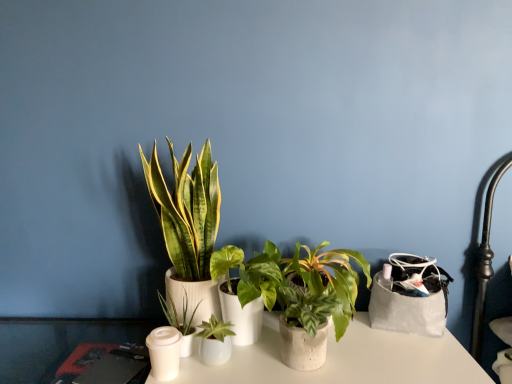
Image resolution: width=512 pixels, height=384 pixels. Describe the element at coordinates (316, 302) in the screenshot. I see `speckled concrete pot at center, the 5th houseplant from the left` at that location.

At what (x,y) coordinates should I click in order to perform the action: click on green leafy plant at center, the first houseplant viewed from the left. Please return your answer as a coordinate pair (x, y). The image size is (512, 384). Looking at the image, I should click on (188, 227).

Where is `green matte plant at center, marked as the 3th houseplant in a right-to-left arrangement`? This screenshot has height=384, width=512. green matte plant at center, marked as the 3th houseplant in a right-to-left arrangement is located at coordinates (215, 341).

Is green leafy plant at center, the fifth houseplant viewed from the right, further to camera compared to green matte plant at center, acting as the second houseplant starting from the right?

Yes, it is behind green matte plant at center, acting as the second houseplant starting from the right.

Which point is more distant from viewer, (204, 251) or (212, 266)?

The point (204, 251) is farther from the camera.

Is green leafy plant at center, the first houseplant viewed from the left, not inside green matte plant at center, the 4th houseplant from the left?

Indeed, green leafy plant at center, the first houseplant viewed from the left, is completely outside green matte plant at center, the 4th houseplant from the left.

Can we say white matte candle holder at lower left lies outside green matte plant at center, acting as the second houseplant starting from the right?

Absolutely, white matte candle holder at lower left is external to green matte plant at center, acting as the second houseplant starting from the right.

From a real-world perspective, is white matte candle holder at lower left physically below green matte plant at center, acting as the second houseplant starting from the right?

Yes, from a real-world perspective, white matte candle holder at lower left is beneath green matte plant at center, acting as the second houseplant starting from the right.

Is white matte candle holder at lower left at the left side of green matte plant at center, the 4th houseplant from the left?

Correct, you'll find white matte candle holder at lower left to the left of green matte plant at center, the 4th houseplant from the left.

Does white matte candle holder at lower left have a greater width compared to green matte plant at center, acting as the second houseplant starting from the right?

In fact, white matte candle holder at lower left might be narrower than green matte plant at center, acting as the second houseplant starting from the right.

Considering the relative positions of green leafy plant at center, the fifth houseplant viewed from the right, and white matte candle holder at lower left in the image provided, is green leafy plant at center, the fifth houseplant viewed from the right, to the right of white matte candle holder at lower left from the viewer's perspective?

Indeed, green leafy plant at center, the fifth houseplant viewed from the right, is positioned on the right side of white matte candle holder at lower left.

Is green leafy plant at center, the first houseplant viewed from the left, facing away from white matte candle holder at lower left?

green leafy plant at center, the first houseplant viewed from the left, is not turned away from white matte candle holder at lower left.

Can you confirm if green leafy plant at center, the first houseplant viewed from the left, is smaller than white matte candle holder at lower left?

No, green leafy plant at center, the first houseplant viewed from the left, is not smaller than white matte candle holder at lower left.

Is there a large distance between green leafy plant at center, the first houseplant viewed from the left, and white matte candle holder at lower left?

They are positioned close to each other.

I want to click on houseplant that is the 1st one when counting upward from the white matte candle holder at lower left (from the image's perspective), so click(x=215, y=341).

Measure the distance from green matte plant at center, marked as the 3th houseplant in a right-to-left arrangement, to white matte candle holder at lower left.

green matte plant at center, marked as the 3th houseplant in a right-to-left arrangement, and white matte candle holder at lower left are 3.51 inches apart from each other.

Looking at their sizes, would you say green matte plant at center, which is counted as the 3th houseplant, starting from the left, is wider or thinner than white matte candle holder at lower left?

green matte plant at center, which is counted as the 3th houseplant, starting from the left, is wider than white matte candle holder at lower left.

Which object is positioned more to the right, green leafy plant at center, the fifth houseplant viewed from the right, or green matte plant at center, which is counted as the 3th houseplant, starting from the left?

green matte plant at center, which is counted as the 3th houseplant, starting from the left, is more to the right.

Does point (178, 305) come closer to viewer compared to point (201, 333)?

That is False.

From a real-world perspective, is green leafy plant at center, the fifth houseplant viewed from the right, positioned over green matte plant at center, which is counted as the 3th houseplant, starting from the left, based on gravity?

→ Yes, from a real-world perspective, green leafy plant at center, the fifth houseplant viewed from the right, is above green matte plant at center, which is counted as the 3th houseplant, starting from the left.

Between green matte plant at center, the 4th houseplant from the left, and speckled concrete pot at center, the 5th houseplant from the left, which one appears on the left side from the viewer's perspective?

From the viewer's perspective, green matte plant at center, the 4th houseplant from the left, appears more on the left side.

Could you tell me if green matte plant at center, acting as the second houseplant starting from the right, is turned towards speckled concrete pot at center, arranged as the 1th houseplant when viewed from the right?

No, green matte plant at center, acting as the second houseplant starting from the right, does not turn towards speckled concrete pot at center, arranged as the 1th houseplant when viewed from the right.

Is green matte plant at center, acting as the second houseplant starting from the right, behind speckled concrete pot at center, arranged as the 1th houseplant when viewed from the right?

No, it is in front of speckled concrete pot at center, arranged as the 1th houseplant when viewed from the right.

From a real-world perspective, between white matte candle holder at lower left and green matte plant at center, the 2th houseplant positioned from the left, who is vertically higher?

green matte plant at center, the 2th houseplant positioned from the left, from a real-world perspective.

Is green matte plant at center, the 2th houseplant positioned from the left, at the back of white matte candle holder at lower left?

Yes, white matte candle holder at lower left is positioned with its back facing green matte plant at center, the 2th houseplant positioned from the left.

What's the angular difference between white matte candle holder at lower left and green matte plant at center, the 2th houseplant positioned from the left,'s facing directions?

The facing directions of white matte candle holder at lower left and green matte plant at center, the 2th houseplant positioned from the left, are 4.82 degrees apart.

From the image's perspective, which houseplant is the 2nd one above the green matte plant at center, acting as the second houseplant starting from the right? Please provide its 2D coordinates.

[(188, 227)]

At what (x,y) coordinates should I click in order to perform the action: click on candle holder that appears behind the green matte plant at center, acting as the second houseplant starting from the right. Please return your answer as a coordinate pair (x, y). Looking at the image, I should click on (164, 352).

When comparing their distances from green matte plant at center, which ranks as the 4th houseplant in right-to-left order, does green matte plant at center, acting as the second houseplant starting from the right, or speckled concrete pot at center, the 5th houseplant from the left, seem further?

speckled concrete pot at center, the 5th houseplant from the left, is positioned further to the anchor green matte plant at center, which ranks as the 4th houseplant in right-to-left order.

When comparing their distances from speckled concrete pot at center, arranged as the 1th houseplant when viewed from the right, does white matte candle holder at lower left or green leafy plant at center, the fifth houseplant viewed from the right, seem closer?

green leafy plant at center, the fifth houseplant viewed from the right, is positioned closer to the anchor speckled concrete pot at center, arranged as the 1th houseplant when viewed from the right.

Which object lies further to the anchor point speckled concrete pot at center, the 5th houseplant from the left, white matte candle holder at lower left or green matte plant at center, acting as the second houseplant starting from the right?

white matte candle holder at lower left.

Estimate the real-world distances between objects in this image. Which object is closer to green matte plant at center, which ranks as the 4th houseplant in right-to-left order, white matte candle holder at lower left or green leafy plant at center, the fifth houseplant viewed from the right?

white matte candle holder at lower left.

From the image, which object appears to be farther from green matte plant at center, which ranks as the 4th houseplant in right-to-left order, green matte plant at center, the 4th houseplant from the left, or green leafy plant at center, the first houseplant viewed from the left?

The object further to green matte plant at center, which ranks as the 4th houseplant in right-to-left order, is green leafy plant at center, the first houseplant viewed from the left.

Based on their spatial positions, is white matte candle holder at lower left or green matte plant at center, the 2th houseplant positioned from the left, closer to green matte plant at center, acting as the second houseplant starting from the right?

Among the two, green matte plant at center, the 2th houseplant positioned from the left, is located nearer to green matte plant at center, acting as the second houseplant starting from the right.

Based on their spatial positions, is green matte plant at center, which is counted as the 3th houseplant, starting from the left, or white matte candle holder at lower left closer to green matte plant at center, acting as the second houseplant starting from the right?

The object closer to green matte plant at center, acting as the second houseplant starting from the right, is green matte plant at center, which is counted as the 3th houseplant, starting from the left.

From the image, which object appears to be farther from white matte candle holder at lower left, green matte plant at center, marked as the 3th houseplant in a right-to-left arrangement, or green matte plant at center, acting as the second houseplant starting from the right?

Among the two, green matte plant at center, acting as the second houseplant starting from the right, is located further to white matte candle holder at lower left.

At what (x,y) coordinates should I click in order to perform the action: click on houseplant located between green matte plant at center, which is counted as the 3th houseplant, starting from the left, and speckled concrete pot at center, arranged as the 1th houseplant when viewed from the right, in the left-right direction. Please return your answer as a coordinate pair (x, y). The image size is (512, 384). Looking at the image, I should click on (247, 288).

Locate an element on the screen. houseplant located between green matte plant at center, the 2th houseplant positioned from the left, and green matte plant at center, the 4th houseplant from the left, in the left-right direction is located at coordinates (215, 341).